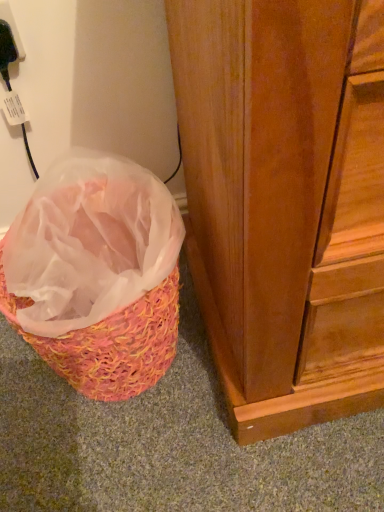
Measure the distance between wooden cabinet at lower left and camera.

The distance of wooden cabinet at lower left from camera is 9.43 inches.

Image resolution: width=384 pixels, height=512 pixels. What do you see at coordinates (285, 201) in the screenshot?
I see `wooden cabinet at lower left` at bounding box center [285, 201].

Locate an element on the screen. Image resolution: width=384 pixels, height=512 pixels. wooden cabinet at lower left is located at coordinates (285, 201).

Locate an element on the screen. Image resolution: width=384 pixels, height=512 pixels. wooden cabinet at lower left is located at coordinates (285, 201).